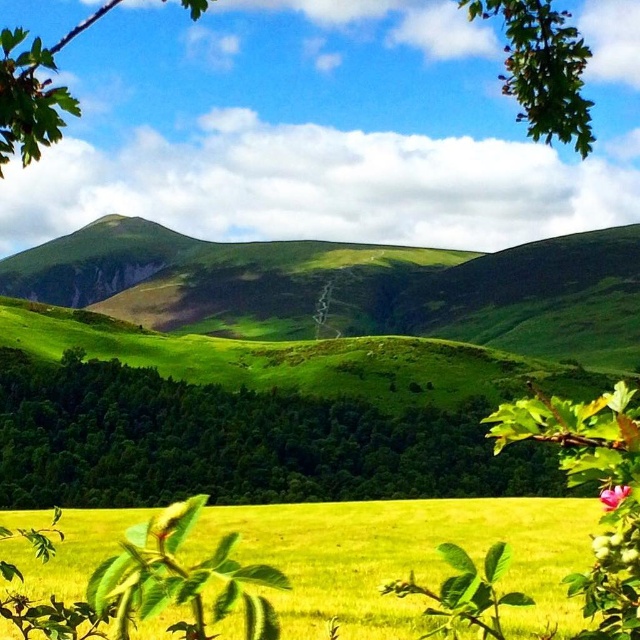
You are standing at the point closer to you in the image. Which point are you at, point (202, 424) or point (502, 84)?

You are at point (202, 424) because it is in front of point (502, 84), making it closer to you.

You are standing at the center of the image and want to walk to the green leafy tree at lower left. Which direction should you face to walk directly towards it?

To reach the green leafy tree at lower left from the center, you should face towards the lower left direction since the tree is located at point (236,442) which is in the lower left quadrant from the center.

You are standing at the point marked by the coordinates point (236, 442) in the image. Looking towards the hills, which direction should you walk to reach the winding path in the middle of the hills?

The point (236, 442) indicates a green leafy tree at lower left. The winding path is in the middle of the hills, so you should walk towards the center of the image to reach it.